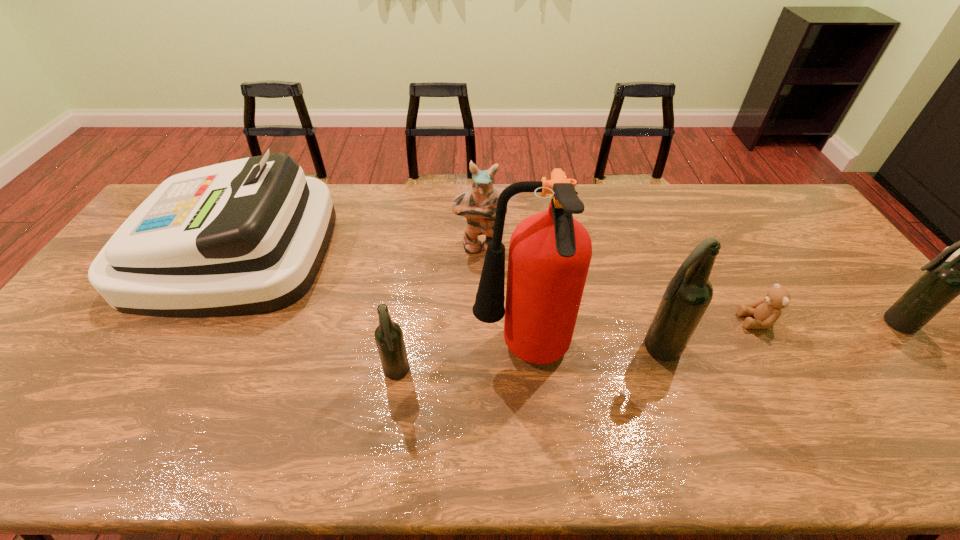
Locate an element on the screen. This screenshot has width=960, height=540. vacant space situated 0.050m at the nozzle of the fire extinguisher is located at coordinates (453, 353).

The height and width of the screenshot is (540, 960). I want to click on vacant space located at the nozzle of the fire extinguisher, so coord(359,353).

Where is `object located at the far edge`? Image resolution: width=960 pixels, height=540 pixels. object located at the far edge is located at coordinates [248, 236].

You are a GUI agent. You are given a task and a screenshot of the screen. Output one action in this format:
    pyautogui.click(x=<x>, y=<y>)
    Task: Click on the beer bottle present at the near edge
    
    Given the screenshot: What is the action you would take?
    pyautogui.click(x=388, y=335)

Find the location of `fire extinguisher present at the near edge`. fire extinguisher present at the near edge is located at coordinates (550, 252).

This screenshot has height=540, width=960. Identify the location of object that is positioned at the left edge. (248, 236).

You are a GUI agent. You are given a task and a screenshot of the screen. Output one action in this format:
    pyautogui.click(x=<x>, y=<y>)
    Task: Click on the object present at the right edge
    The width and height of the screenshot is (960, 540).
    Given the screenshot: What is the action you would take?
    pyautogui.click(x=943, y=281)

Where is `object positioned at the far left corner`? object positioned at the far left corner is located at coordinates (248, 236).

The image size is (960, 540). In order to click on vacant space at the far edge of the desktop in this screenshot , I will do `click(593, 211)`.

You are a GUI agent. You are given a task and a screenshot of the screen. Output one action in this format:
    pyautogui.click(x=<x>, y=<y>)
    Task: Click on the free space at the near edge of the desktop
    
    Given the screenshot: What is the action you would take?
    pyautogui.click(x=249, y=408)